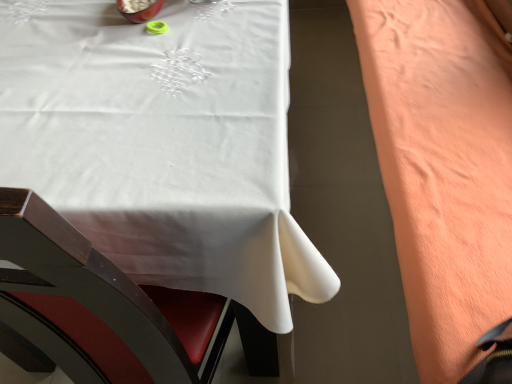
Image resolution: width=512 pixels, height=384 pixels. Describe the element at coordinates (443, 167) in the screenshot. I see `coral fleece blanket at right` at that location.

Measure the distance between coral fleece blanket at right and camera.

coral fleece blanket at right and camera are 62.50 centimeters apart from each other.

At what (x,y) coordinates should I click in order to perform the action: click on coral fleece blanket at right. Please return your answer as a coordinate pair (x, y). Looking at the image, I should click on 443,167.

Measure the distance between point (165, 130) and camera.

Point (165, 130) and camera are 28.78 inches apart from each other.

The image size is (512, 384). What do you see at coordinates (163, 143) in the screenshot? I see `white fabric table at upper left` at bounding box center [163, 143].

Locate an element on the screen. The width and height of the screenshot is (512, 384). white fabric table at upper left is located at coordinates (163, 143).

Locate an element on the screen. The image size is (512, 384). coral fleece blanket at right is located at coordinates (443, 167).

Which is more to the right, white fabric table at upper left or coral fleece blanket at right?

coral fleece blanket at right is more to the right.

Which object is more forward, white fabric table at upper left or coral fleece blanket at right?

Positioned in front is white fabric table at upper left.

Between point (28, 91) and point (472, 363), which one is positioned in front?

Positioned in front is point (472, 363).

From the image's perspective, is white fabric table at upper left under coral fleece blanket at right?

No, from the image's perspective, white fabric table at upper left is not below coral fleece blanket at right.

From a real-world perspective, is white fabric table at upper left located beneath coral fleece blanket at right?

Yes, from a real-world perspective, white fabric table at upper left is below coral fleece blanket at right.

In terms of width, does white fabric table at upper left look wider or thinner when compared to coral fleece blanket at right?

white fabric table at upper left is wider than coral fleece blanket at right.

Between white fabric table at upper left and coral fleece blanket at right, which one has more height?

Standing taller between the two is white fabric table at upper left.

Is white fabric table at upper left bigger or smaller than coral fleece blanket at right?

In the image, white fabric table at upper left appears to be larger than coral fleece blanket at right.

Could coral fleece blanket at right be considered to be inside white fabric table at upper left?

No, coral fleece blanket at right is not inside white fabric table at upper left.

Does white fabric table at upper left touch coral fleece blanket at right?

No, white fabric table at upper left is not next to coral fleece blanket at right.

Is white fabric table at upper left positioned with its back to coral fleece blanket at right?

Yes.

How different are the orientations of white fabric table at upper left and coral fleece blanket at right in degrees?

0.766 degrees.

Find the location of a particular element. table that is in front of the coral fleece blanket at right is located at coordinates (163, 143).

Based on the photo, is coral fleece blanket at right to the right of white fabric table at upper left from the viewer's perspective?

Yes.

Consider the image. Which is behind, coral fleece blanket at right or white fabric table at upper left?

coral fleece blanket at right.

Which is behind, point (496, 80) or point (20, 187)?

The point (496, 80) is farther.

From the image's perspective, does coral fleece blanket at right appear lower than white fabric table at upper left?

Indeed, from the image's perspective, coral fleece blanket at right is shown beneath white fabric table at upper left.

Consider the image. From a real-world perspective, is coral fleece blanket at right over white fabric table at upper left?

Yes.

Which object is thinner, coral fleece blanket at right or white fabric table at upper left?

coral fleece blanket at right is thinner.

Considering the sizes of objects coral fleece blanket at right and white fabric table at upper left in the image provided, who is shorter, coral fleece blanket at right or white fabric table at upper left?

Standing shorter between the two is coral fleece blanket at right.

Considering the relative sizes of coral fleece blanket at right and white fabric table at upper left in the image provided, is coral fleece blanket at right smaller than white fabric table at upper left?

Yes, coral fleece blanket at right is smaller than white fabric table at upper left.

Looking at this image, is coral fleece blanket at right not inside white fabric table at upper left?

Absolutely, coral fleece blanket at right is external to white fabric table at upper left.

In the scene shown: Can you see coral fleece blanket at right touching white fabric table at upper left?

No, coral fleece blanket at right is not in contact with white fabric table at upper left.

Is coral fleece blanket at right aimed at white fabric table at upper left?

Yes, coral fleece blanket at right is oriented towards white fabric table at upper left.

Can you tell me how much coral fleece blanket at right and white fabric table at upper left differ in facing direction?

There is a 0.766-degree angle between the facing directions of coral fleece blanket at right and white fabric table at upper left.

At what (x,y) coordinates should I click in order to perform the action: click on table located on the left of coral fleece blanket at right. Please return your answer as a coordinate pair (x, y). This screenshot has height=384, width=512. Looking at the image, I should click on (163, 143).

The width and height of the screenshot is (512, 384). I want to click on table that is in front of the coral fleece blanket at right, so click(163, 143).

The height and width of the screenshot is (384, 512). What are the coordinates of `blanket on the right of white fabric table at upper left` in the screenshot? It's located at (443, 167).